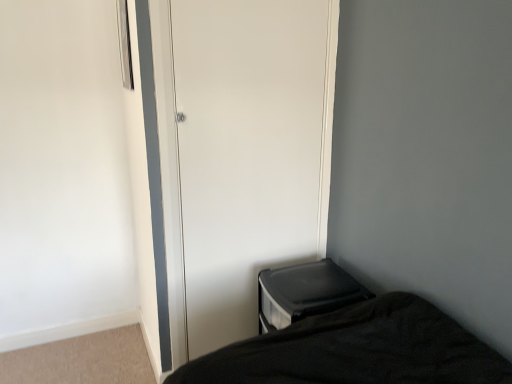
This screenshot has width=512, height=384. What do you see at coordinates (304, 293) in the screenshot?
I see `black plastic changing table at lower right` at bounding box center [304, 293].

Where is `black plastic changing table at lower right`? The image size is (512, 384). black plastic changing table at lower right is located at coordinates (304, 293).

In order to face black plastic changing table at lower right, should I rotate leftwards or rightwards?

Turn right approximately 7.267 degrees to face it.

Measure the distance between white glossy door at center and camera.

white glossy door at center is 1.52 meters away from camera.

Describe the element at coordinates (243, 154) in the screenshot. I see `white glossy door at center` at that location.

Identify the location of white glossy door at center. The image size is (512, 384). (243, 154).

What is the approximate height of white glossy door at center?

5.56 feet.

Locate an element on the screen. black plastic changing table at lower right is located at coordinates (304, 293).

Can you confirm if white glossy door at center is positioned to the right of black plastic changing table at lower right?

In fact, white glossy door at center is to the left of black plastic changing table at lower right.

Considering their positions, is white glossy door at center located in front of or behind black plastic changing table at lower right?

In the image, white glossy door at center appears in front of black plastic changing table at lower right.

Considering the positions of points (265, 223) and (262, 302), is point (265, 223) closer to camera compared to point (262, 302)?

No, it is not.

From the image's perspective, is white glossy door at center positioned above or below black plastic changing table at lower right?

Clearly, from the image's perspective, white glossy door at center is above black plastic changing table at lower right.

From a real-world perspective, does white glossy door at center stand above black plastic changing table at lower right?

Yes, from a real-world perspective, white glossy door at center is above black plastic changing table at lower right.

Between white glossy door at center and black plastic changing table at lower right, which one has smaller width?

With smaller width is white glossy door at center.

From their relative heights in the image, would you say white glossy door at center is taller or shorter than black plastic changing table at lower right?

white glossy door at center is taller than black plastic changing table at lower right.

Considering the sizes of objects white glossy door at center and black plastic changing table at lower right in the image provided, who is bigger, white glossy door at center or black plastic changing table at lower right?

black plastic changing table at lower right.

Choose the correct answer: Is white glossy door at center inside black plastic changing table at lower right or outside it?

white glossy door at center is not enclosed by black plastic changing table at lower right.

Is the surface of white glossy door at center in direct contact with black plastic changing table at lower right?

They are not placed beside each other.

Is white glossy door at center aimed at black plastic changing table at lower right?

Yes, white glossy door at center is turned towards black plastic changing table at lower right.

In order to click on screen door located above the black plastic changing table at lower right (from the image's perspective) in this screenshot , I will do [243, 154].

Considering the positions of objects black plastic changing table at lower right and white glossy door at center in the image provided, who is more to the left, black plastic changing table at lower right or white glossy door at center?

From the viewer's perspective, white glossy door at center appears more on the left side.

Which object is closer to the camera taking this photo, black plastic changing table at lower right or white glossy door at center?

white glossy door at center is more forward.

Which is behind, point (347, 274) or point (325, 44)?

The point (347, 274) is farther from the camera.

From the image's perspective, relative to white glossy door at center, is black plastic changing table at lower right above or below?

black plastic changing table at lower right is situated lower than white glossy door at center in the image.

From a real-world perspective, is black plastic changing table at lower right below white glossy door at center?

Correct, in the physical world, black plastic changing table at lower right is lower than white glossy door at center.

Is black plastic changing table at lower right thinner than white glossy door at center?

Incorrect, the width of black plastic changing table at lower right is not less than that of white glossy door at center.

Between black plastic changing table at lower right and white glossy door at center, which one has less height?

With less height is black plastic changing table at lower right.

From the picture: Looking at the image, does black plastic changing table at lower right seem bigger or smaller compared to white glossy door at center?

black plastic changing table at lower right is bigger than white glossy door at center.

Is black plastic changing table at lower right inside the boundaries of white glossy door at center, or outside?

black plastic changing table at lower right is located beyond the bounds of white glossy door at center.

Would you say black plastic changing table at lower right is a long distance from white glossy door at center?

No, there isn't a large distance between black plastic changing table at lower right and white glossy door at center.

Does black plastic changing table at lower right turn towards white glossy door at center?

No, black plastic changing table at lower right is not aimed at white glossy door at center.

The width and height of the screenshot is (512, 384). I want to click on changing table below the white glossy door at center (from the image's perspective), so click(x=304, y=293).

Identify the location of screen door above the black plastic changing table at lower right (from the image's perspective). (243, 154).

The width and height of the screenshot is (512, 384). What are the coordinates of `changing table below the white glossy door at center (from the image's perspective)` in the screenshot? It's located at (304, 293).